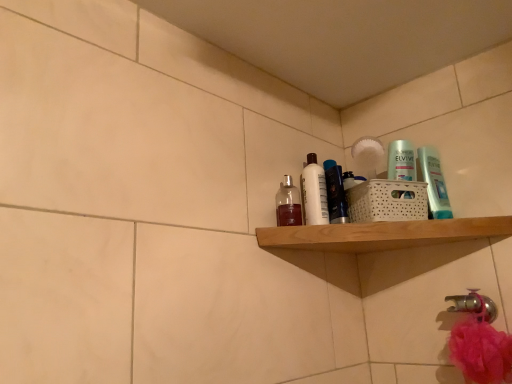
Question: Does translucent glass bottle at upper center, placed as the first toiletry when sorted from left to right, have a smaller size compared to translucent plastic bottle at upper right, which is counted as the 4th toiletry, starting from the left?

Choices:
 (A) yes
 (B) no

Answer: (B)

Question: Does translucent glass bottle at upper center, the 4th toiletry positioned from the right, have a greater width compared to translucent plastic bottle at upper right, which is counted as the 4th toiletry, starting from the left?

Choices:
 (A) yes
 (B) no

Answer: (A)

Question: Does translucent glass bottle at upper center, placed as the first toiletry when sorted from left to right, have a larger size compared to translucent plastic bottle at upper right, which is counted as the 4th toiletry, starting from the left?

Choices:
 (A) yes
 (B) no

Answer: (A)

Question: From a real-world perspective, is translucent glass bottle at upper center, placed as the first toiletry when sorted from left to right, on translucent plastic bottle at upper right, the 1th toiletry when ordered from right to left?

Choices:
 (A) no
 (B) yes

Answer: (A)

Question: Is translucent glass bottle at upper center, placed as the first toiletry when sorted from left to right, at the left side of translucent plastic bottle at upper right, which is counted as the 4th toiletry, starting from the left?

Choices:
 (A) yes
 (B) no

Answer: (A)

Question: Is translucent glass bottle at upper center, placed as the first toiletry when sorted from left to right, positioned beyond the bounds of translucent plastic bottle at upper right, which is counted as the 4th toiletry, starting from the left?

Choices:
 (A) yes
 (B) no

Answer: (A)

Question: From a real-world perspective, is translucent plastic bottle at upper right, which is counted as the 4th toiletry, starting from the left, below shiny black bottle at center, which is the third toiletry in left-to-right order?

Choices:
 (A) yes
 (B) no

Answer: (A)

Question: Would you say shiny black bottle at center, which is the 2th toiletry in right-to-left order, is part of translucent plastic bottle at upper right, which is counted as the 4th toiletry, starting from the left,'s contents?

Choices:
 (A) yes
 (B) no

Answer: (B)

Question: From the image's perspective, does translucent plastic bottle at upper right, which is counted as the 4th toiletry, starting from the left, appear lower than shiny black bottle at center, which is the third toiletry in left-to-right order?

Choices:
 (A) no
 (B) yes

Answer: (A)

Question: Is translucent plastic bottle at upper right, which is counted as the 4th toiletry, starting from the left, at the right side of shiny black bottle at center, which is the 2th toiletry in right-to-left order?

Choices:
 (A) yes
 (B) no

Answer: (A)

Question: Considering the relative positions of translucent plastic bottle at upper right, which is counted as the 4th toiletry, starting from the left, and shiny black bottle at center, which is the 2th toiletry in right-to-left order, in the image provided, is translucent plastic bottle at upper right, which is counted as the 4th toiletry, starting from the left, in front of shiny black bottle at center, which is the 2th toiletry in right-to-left order,?

Choices:
 (A) no
 (B) yes

Answer: (B)

Question: Does translucent plastic bottle at upper right, which is counted as the 4th toiletry, starting from the left, have a greater height compared to shiny black bottle at center, which is the 2th toiletry in right-to-left order?

Choices:
 (A) yes
 (B) no

Answer: (B)

Question: Can you confirm if shiny black bottle at center, which is the third toiletry in left-to-right order, is taller than translucent glass bottle at upper center, placed as the first toiletry when sorted from left to right?

Choices:
 (A) no
 (B) yes

Answer: (B)